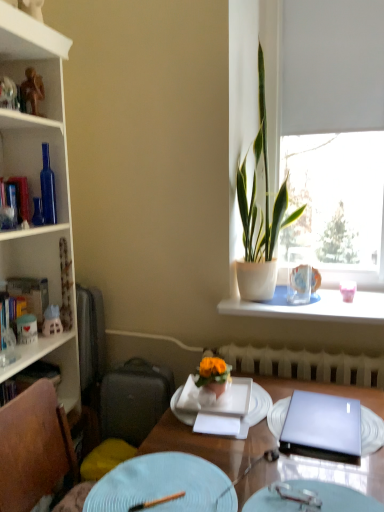
The width and height of the screenshot is (384, 512). I want to click on free spot to the right of wooden chopstick at lower center, acting as the 3th tableware starting from the back, so click(219, 488).